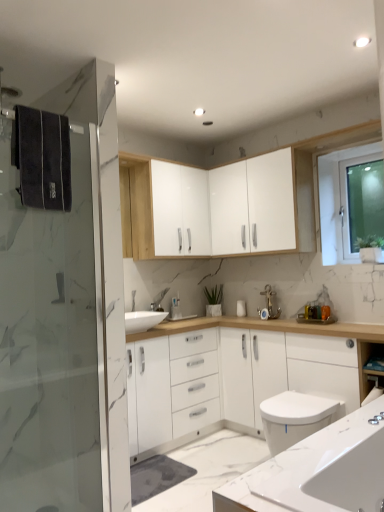
Question: In terms of height, does white glossy cabinet at upper center, the 1th cabinetry when ordered from left to right, look taller or shorter compared to white marble countertop at lower right?

Choices:
 (A) tall
 (B) short

Answer: (A)

Question: From a real-world perspective, is white glossy cabinet at upper center, the 1th cabinetry when ordered from left to right, above or below white marble countertop at lower right?

Choices:
 (A) below
 (B) above

Answer: (B)

Question: Estimate the real-world distances between objects in this image. Which object is closer to the gold metallic faucet at center?

Choices:
 (A) white marble countertop at lower right
 (B) white glossy cabinet at upper center, the first cabinetry from the right
 (C) white glossy cabinet at upper center, the 1th cabinetry when ordered from left to right
 (D) white glossy cabinet at lower right
 (E) transparent glass window at upper right

Answer: (B)

Question: Based on their relative distances, which object is farther from the white marble countertop at lower right?

Choices:
 (A) transparent glass screen door at left
 (B) white glossy cabinet at upper center, positioned as the 2th cabinetry in left-to-right order
 (C) white glossy cabinet at upper center, the 1th cabinetry when ordered from left to right
 (D) gold metallic faucet at center
 (E) transparent glass window at upper right

Answer: (C)